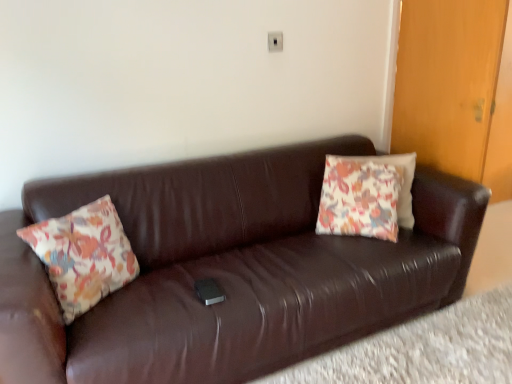
Question: Considering the relative sizes of floral fabric pillow at center, acting as the second pillow starting from the front, and floral fabric pillow at left, which is counted as the 2th pillow, starting from the back, in the image provided, is floral fabric pillow at center, acting as the second pillow starting from the front, bigger than floral fabric pillow at left, which is counted as the 2th pillow, starting from the back,?

Choices:
 (A) no
 (B) yes

Answer: (B)

Question: Considering the relative positions of floral fabric pillow at center, which ranks as the first pillow in right-to-left order, and floral fabric pillow at left, the second pillow from the right, in the image provided, is floral fabric pillow at center, which ranks as the first pillow in right-to-left order, to the left of floral fabric pillow at left, the second pillow from the right, from the viewer's perspective?

Choices:
 (A) yes
 (B) no

Answer: (B)

Question: Is floral fabric pillow at center, marked as the first pillow in a back-to-front arrangement, taller than floral fabric pillow at left, which is counted as the 2th pillow, starting from the back?

Choices:
 (A) yes
 (B) no

Answer: (A)

Question: From a real-world perspective, is floral fabric pillow at center, marked as the first pillow in a back-to-front arrangement, positioned over floral fabric pillow at left, arranged as the 1th pillow when viewed from the front, based on gravity?

Choices:
 (A) no
 (B) yes

Answer: (B)

Question: Is the position of floral fabric pillow at center, which ranks as the first pillow in right-to-left order, more distant than that of floral fabric pillow at left, acting as the first pillow starting from the left?

Choices:
 (A) no
 (B) yes

Answer: (B)

Question: Does floral fabric pillow at center, the second pillow in the left-to-right sequence, have a smaller size compared to floral fabric pillow at left, acting as the first pillow starting from the left?

Choices:
 (A) yes
 (B) no

Answer: (B)

Question: Considering the relative sizes of brown leather couch at lower center and floral fabric pillow at center, which ranks as the first pillow in right-to-left order, in the image provided, is brown leather couch at lower center wider than floral fabric pillow at center, which ranks as the first pillow in right-to-left order,?

Choices:
 (A) no
 (B) yes

Answer: (B)

Question: Is brown leather couch at lower center turned away from floral fabric pillow at center, marked as the first pillow in a back-to-front arrangement?

Choices:
 (A) no
 (B) yes

Answer: (A)

Question: Does brown leather couch at lower center come behind floral fabric pillow at center, acting as the second pillow starting from the front?

Choices:
 (A) no
 (B) yes

Answer: (A)

Question: Does brown leather couch at lower center have a larger size compared to floral fabric pillow at center, acting as the second pillow starting from the front?

Choices:
 (A) yes
 (B) no

Answer: (B)

Question: From a real-world perspective, is brown leather couch at lower center below floral fabric pillow at center, which ranks as the first pillow in right-to-left order?

Choices:
 (A) yes
 (B) no

Answer: (A)

Question: Would you say brown leather couch at lower center is a long distance from floral fabric pillow at center, acting as the second pillow starting from the front?

Choices:
 (A) yes
 (B) no

Answer: (B)

Question: Considering the relative sizes of wooden door at right and brown leather couch at center in the image provided, is wooden door at right taller than brown leather couch at center?

Choices:
 (A) yes
 (B) no

Answer: (A)